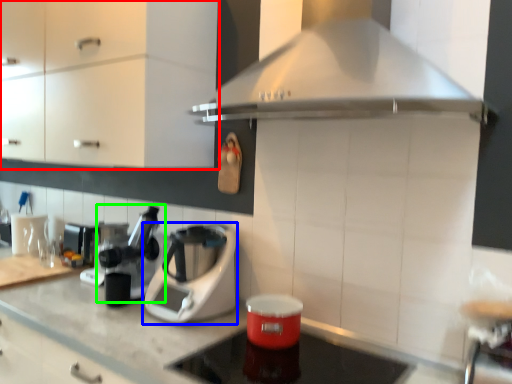
Question: Estimate the real-world distances between objects in this image. Which object is farther from cabinetry (highlighted by a red box), kitchen appliance (highlighted by a blue box) or coffee machine (highlighted by a green box)?

Choices:
 (A) kitchen appliance
 (B) coffee machine

Answer: (A)